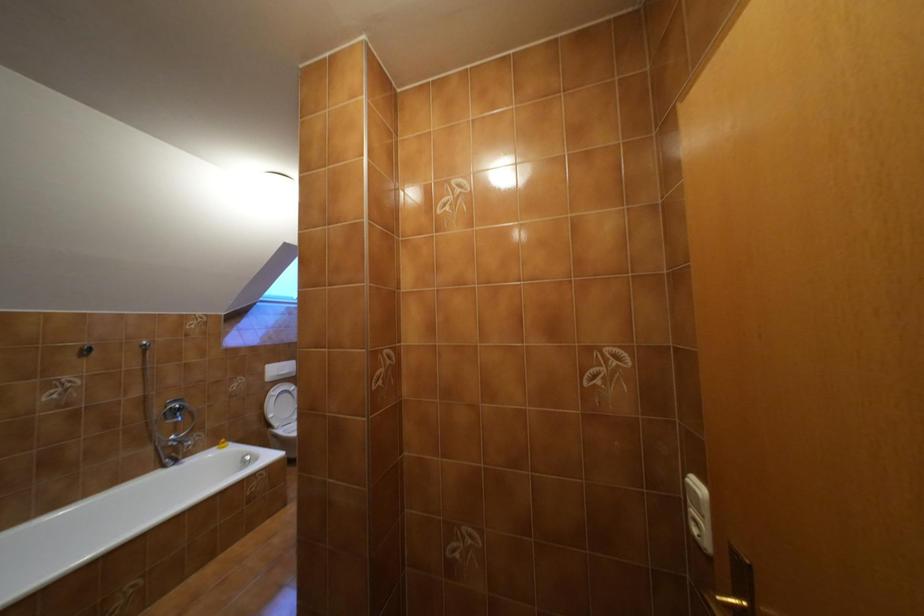
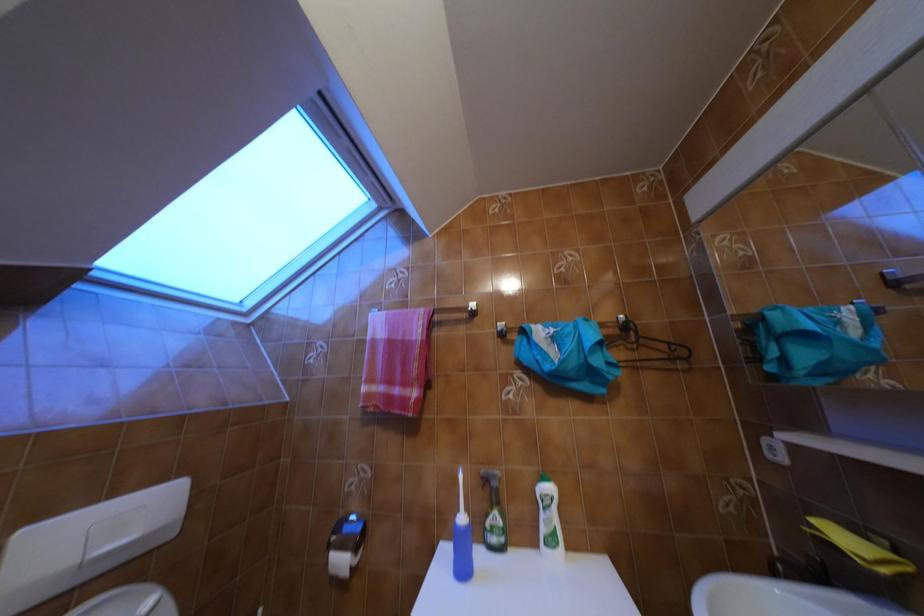
From the picture: What movement of the cameraman would produce the second image?

The cameraman walked toward left, forward.